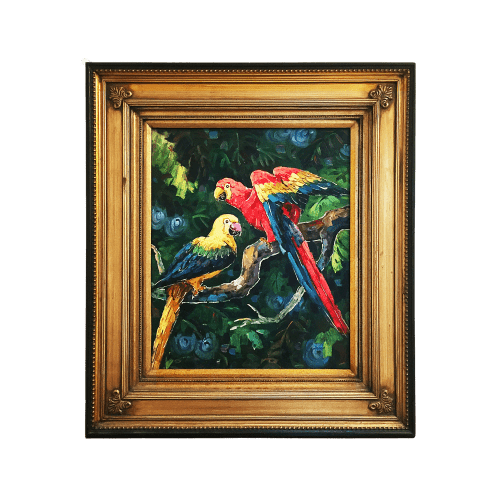
This screenshot has height=500, width=500. Identify the location of frame. (296, 412).